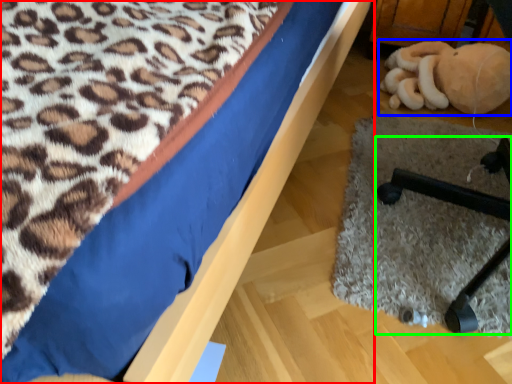
Question: Considering the real-world distances, which object is closest to bed (highlighted by a red box)? toy (highlighted by a blue box) or furniture (highlighted by a green box).

Choices:
 (A) toy
 (B) furniture

Answer: (B)